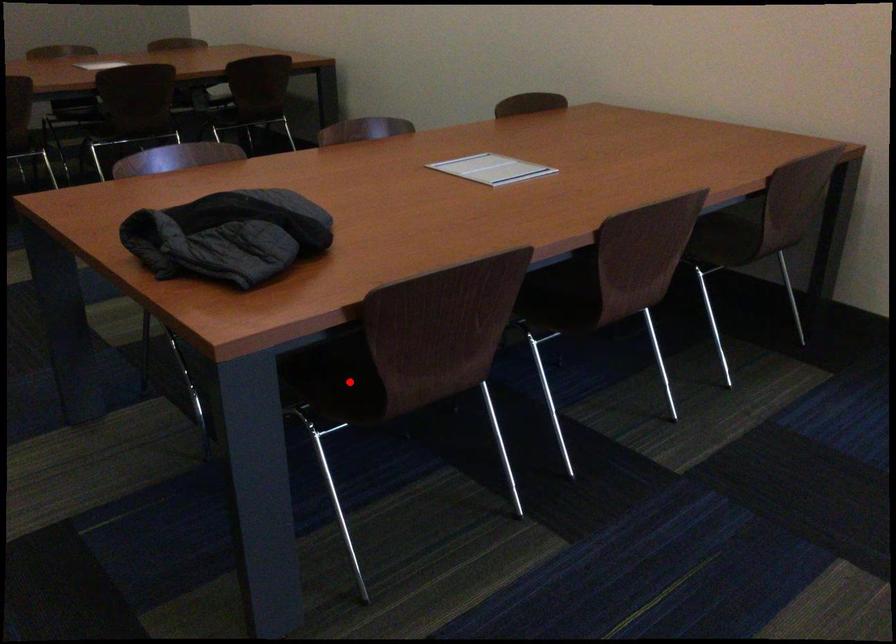
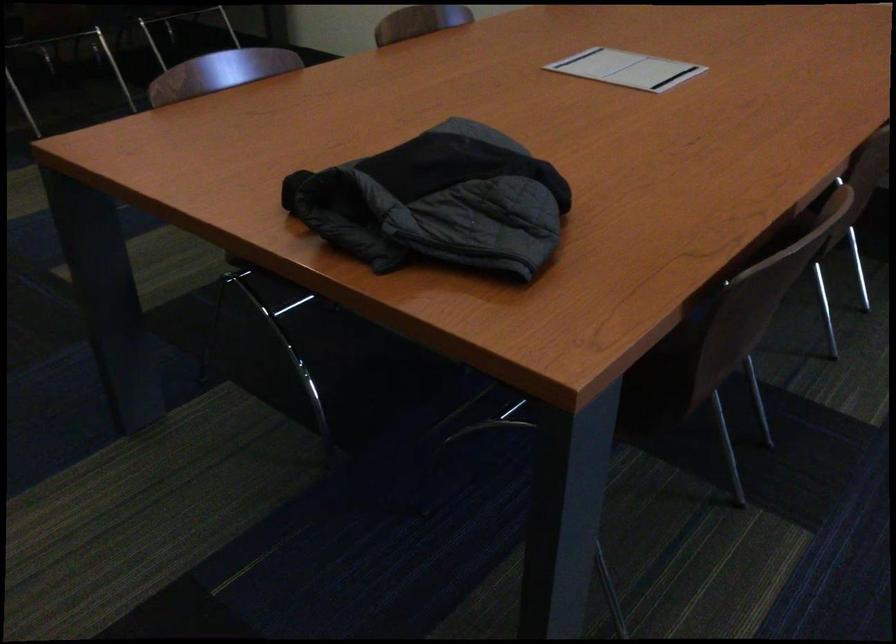
Question: I am providing you with two images of the same scene from different viewpoints. A red point is marked on the first image. Can you still see the location of the red point in image 2?

Choices:
 (A) Yes
 (B) No

Answer: (B)